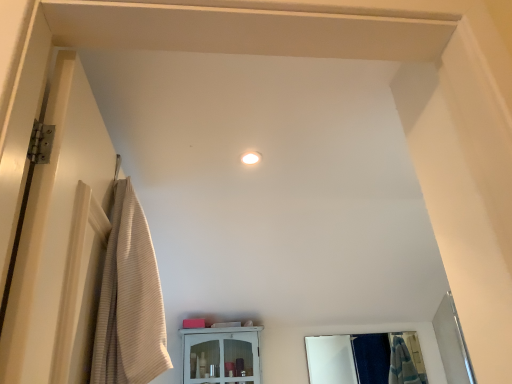
Question: Does white glossy cabinet at center come behind beige ribbed towel at left?

Choices:
 (A) no
 (B) yes

Answer: (B)

Question: From a real-world perspective, does white glossy cabinet at center stand above beige ribbed towel at left?

Choices:
 (A) yes
 (B) no

Answer: (B)

Question: Considering the relative sizes of white glossy cabinet at center and beige ribbed towel at left in the image provided, is white glossy cabinet at center taller than beige ribbed towel at left?

Choices:
 (A) no
 (B) yes

Answer: (A)

Question: Is white glossy cabinet at center smaller than beige ribbed towel at left?

Choices:
 (A) yes
 (B) no

Answer: (A)

Question: Is white glossy cabinet at center facing towards beige ribbed towel at left?

Choices:
 (A) no
 (B) yes

Answer: (B)

Question: Is white glossy cabinet at center looking in the opposite direction of beige ribbed towel at left?

Choices:
 (A) no
 (B) yes

Answer: (A)

Question: Does beige ribbed towel at left have a lesser height compared to white glossy cabinet at center?

Choices:
 (A) yes
 (B) no

Answer: (B)

Question: Does beige ribbed towel at left have a smaller size compared to white glossy cabinet at center?

Choices:
 (A) yes
 (B) no

Answer: (B)

Question: From the image's perspective, is beige ribbed towel at left on top of white glossy cabinet at center?

Choices:
 (A) no
 (B) yes

Answer: (B)

Question: Is beige ribbed towel at left next to white glossy cabinet at center and touching it?

Choices:
 (A) no
 (B) yes

Answer: (A)

Question: Are beige ribbed towel at left and white glossy cabinet at center located far from each other?

Choices:
 (A) yes
 (B) no

Answer: (A)

Question: Does beige ribbed towel at left appear on the right side of white glossy cabinet at center?

Choices:
 (A) no
 (B) yes

Answer: (A)

Question: Is beige ribbed towel at left bigger than clear glass mirror at center?

Choices:
 (A) yes
 (B) no

Answer: (A)